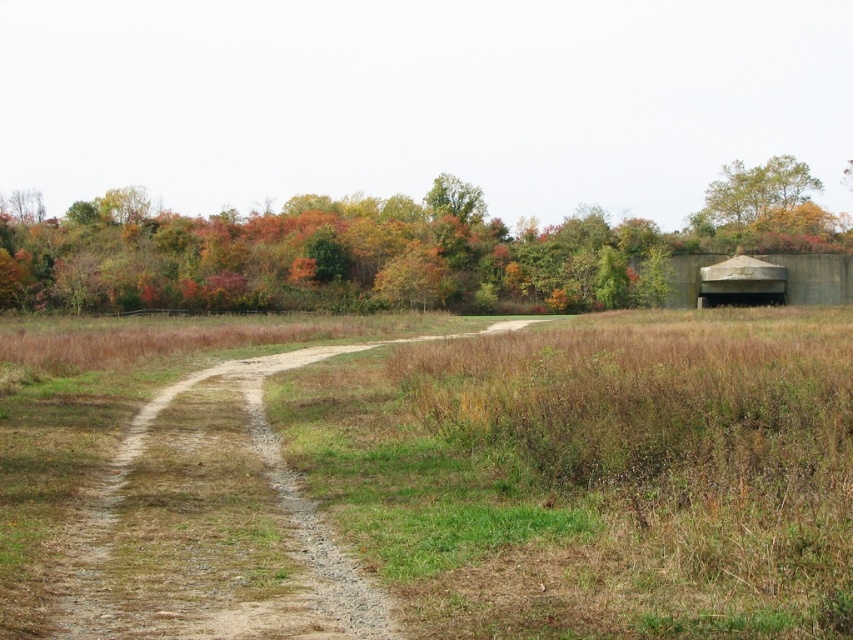
Question: Does green matte tree at upper right have a larger size compared to dirt/gravel trail at center?

Choices:
 (A) yes
 (B) no

Answer: (A)

Question: Which object is the closest to the yellow-green foliage at upper right?

Choices:
 (A) dirt/gravel trail at center
 (B) concrete bunker at right
 (C) green matte tree at upper right

Answer: (C)

Question: Which point is closer to the camera taking this photo?

Choices:
 (A) click(x=776, y=282)
 (B) click(x=148, y=529)
 (C) click(x=706, y=195)
 (D) click(x=549, y=227)

Answer: (B)

Question: Can you confirm if concrete bunker at right is positioned below green leafy tree at upper center?

Choices:
 (A) yes
 (B) no

Answer: (A)

Question: Estimate the real-world distances between objects in this image. Which object is closer to the green matte tree at upper right?

Choices:
 (A) green leafy tree at upper center
 (B) yellow-green foliage at upper right
 (C) dirt/gravel trail at center

Answer: (A)

Question: Is green matte tree at upper right positioned at the back of dirt/gravel trail at center?

Choices:
 (A) no
 (B) yes

Answer: (B)